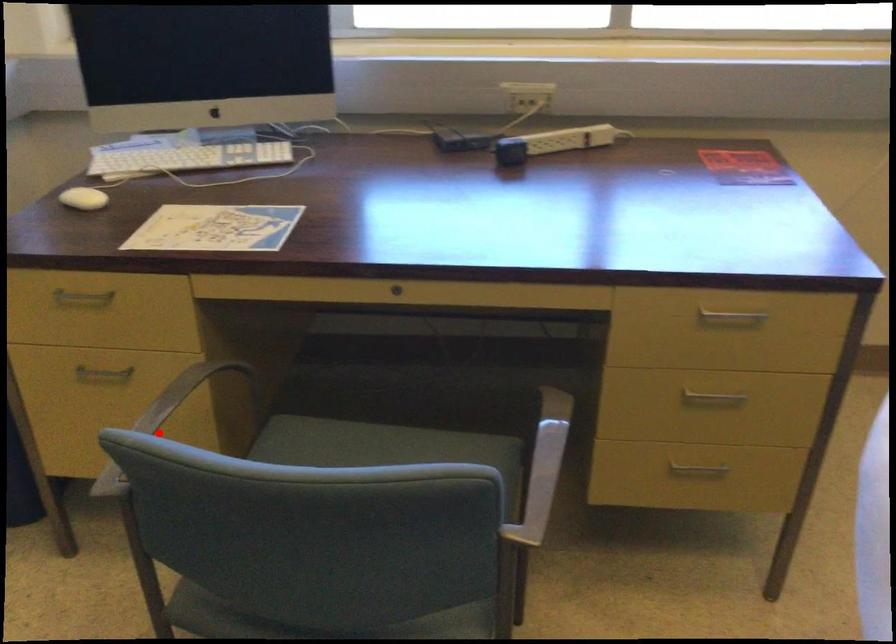
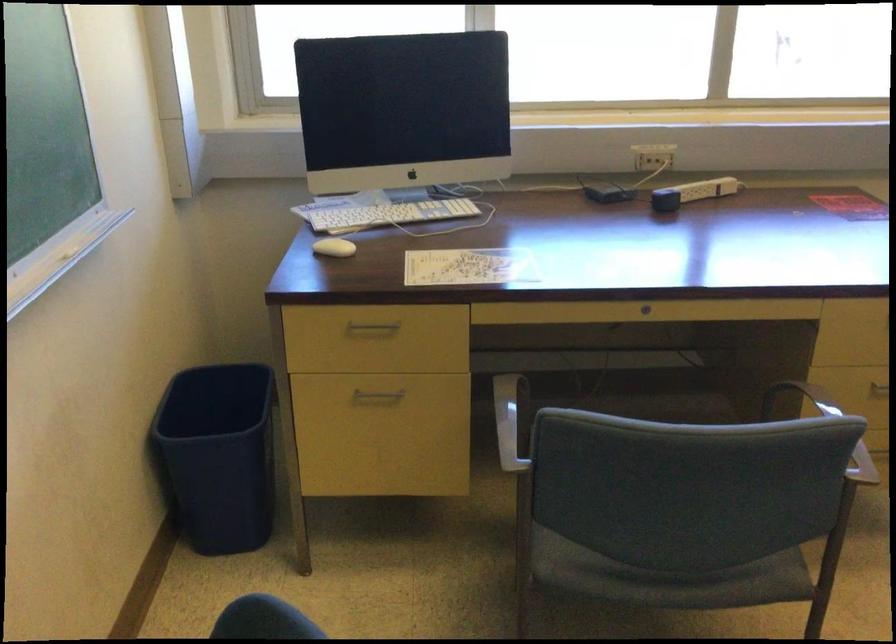
Question: I am providing you with two images of the same scene from different viewpoints. In image1, a red point is highlighted. Considering the same 3D point in image2, which of the following is correct?

Choices:
 (A) It is closer
 (B) It is farther

Answer: (B)